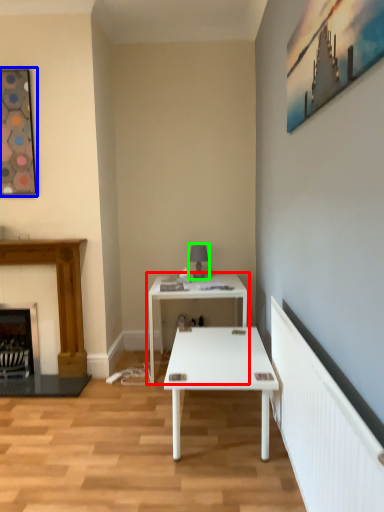
Question: Which object is the closest to the table (highlighted by a red box)? Choose among these: picture frame (highlighted by a blue box) or table lamp (highlighted by a green box).

Choices:
 (A) picture frame
 (B) table lamp

Answer: (B)